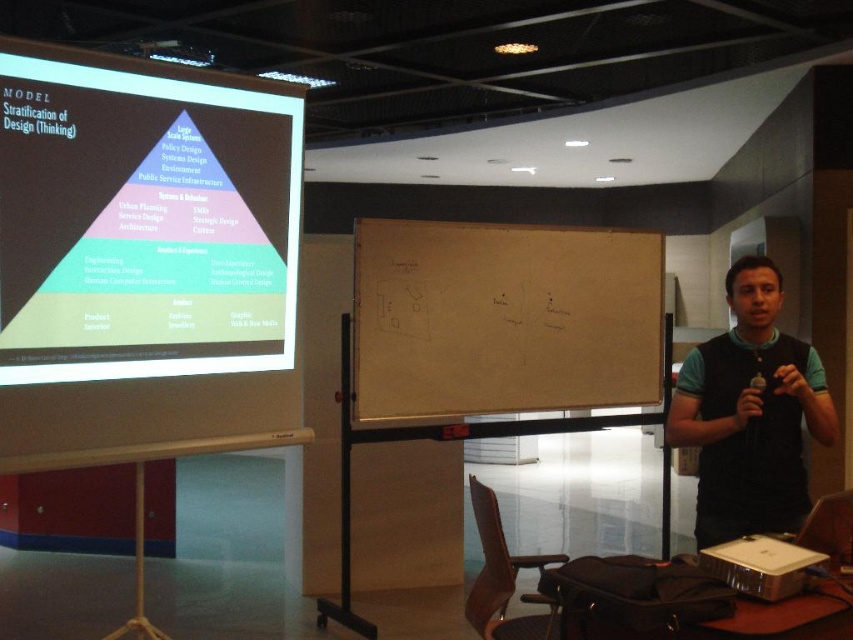
You are an attendee at the presentation and need to take notes on the white chalkboard at center. Which object is closer to your current position if you are standing in front of the matte projector screen at upper left?

The white chalkboard at center is closer to your current position because the matte projector screen at upper left is to the left of the white chalkboard at center, meaning the chalkboard is positioned to the right of the screen and likely within closer proximity when standing in front of the screen.

You are an attendee at the presentation and want to take a photo of the diagram displayed on the matte projector screen at upper left. However, there is a light source directly in front of you. Based on the diagram location, where should you position yourself to avoid the light glare? Please provide coordinates in the format of point coordinates like point (143, 257).

The matte projector screen at upper left is located at point (143, 257). To avoid the light glare, position yourself to the right or left side of the screen, ensuring the light source is not directly between you and the screen. The exact coordinates depend on the light source location, but positioning near point 0.6, 0.2 or point 0.2, 0.2 might help reduce glare.

You are organizing a design workshop and need to decide where to place a large poster. The poster is too big to fit on the white chalkboard at center. Can it fit on the matte projector screen at upper left?

The matte projector screen at upper left occupies less space than the white chalkboard at center. Since the poster is too big for the white chalkboard at center, it will also be too large to fit on the matte projector screen at upper left.